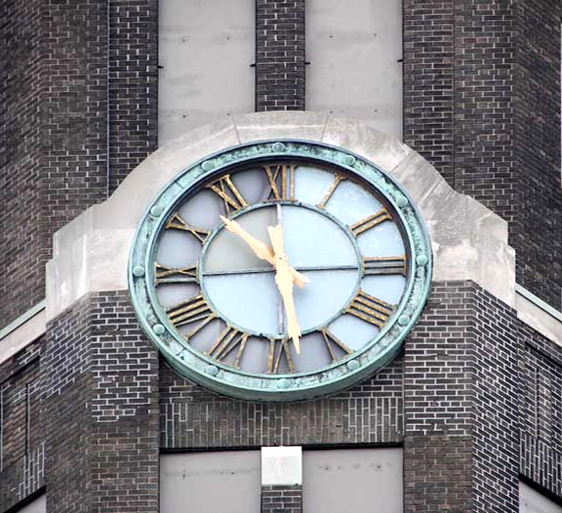
At what (x,y) coordinates should I click in order to perform the action: click on clock. Please return your answer as a coordinate pair (x, y). Looking at the image, I should click on (287, 264).